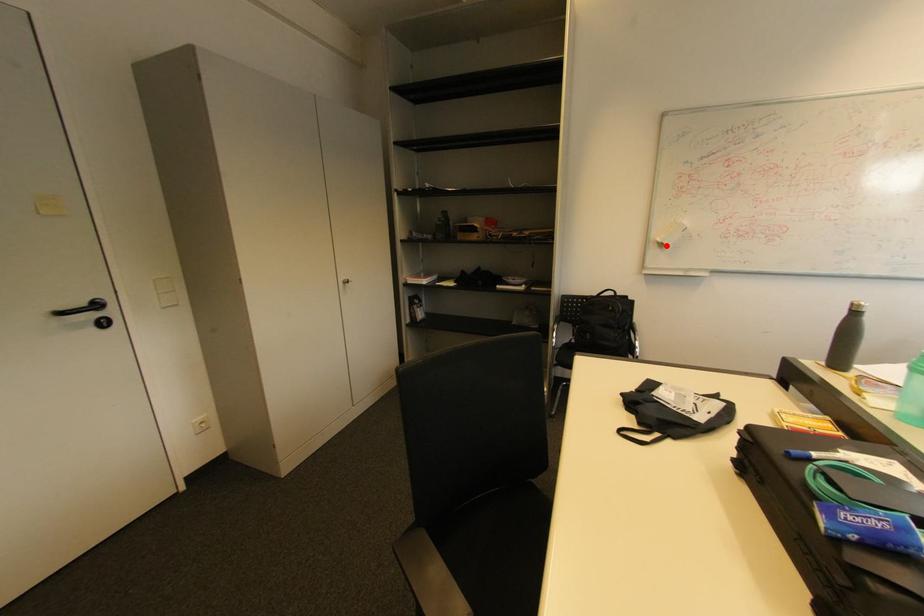
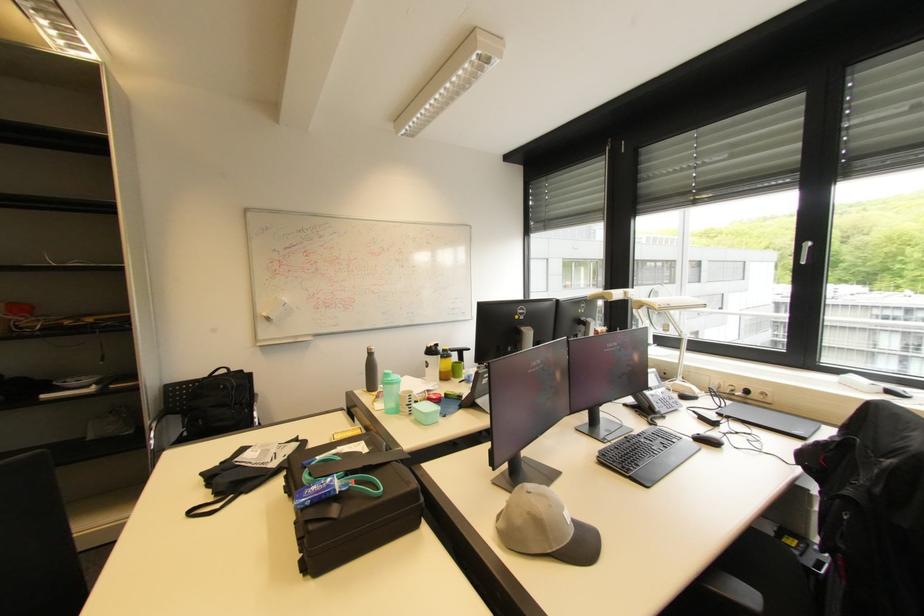
The point at the highlighted location is marked in the first image. Where is the corresponding point in the second image?

(273, 320)